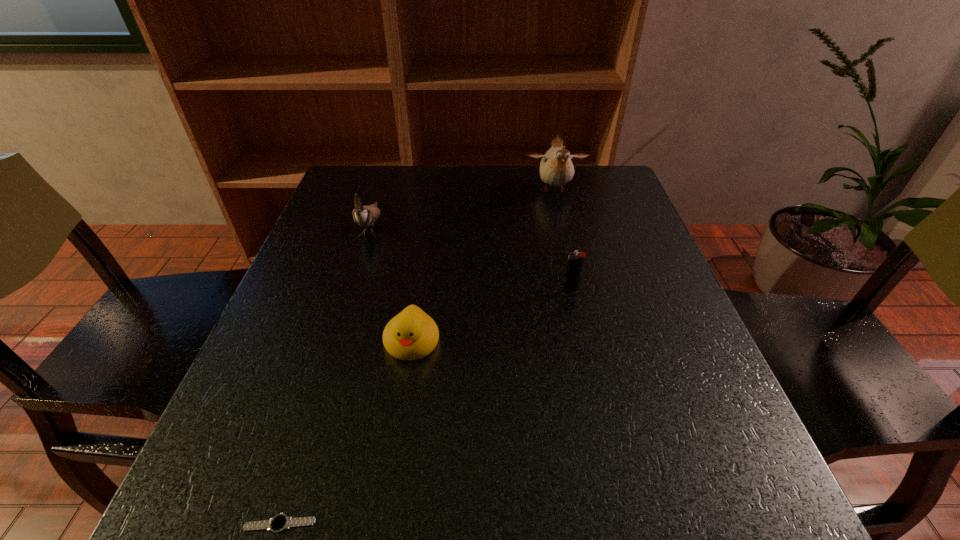
Find the location of a particular element. The width and height of the screenshot is (960, 540). the taller bird is located at coordinates click(x=556, y=167).

The image size is (960, 540). I want to click on the tallest object, so click(556, 167).

Where is `the second tallest object`? Image resolution: width=960 pixels, height=540 pixels. the second tallest object is located at coordinates (365, 216).

At what (x,y) coordinates should I click in order to perform the action: click on the nearer bird. Please return your answer as a coordinate pair (x, y). This screenshot has width=960, height=540. Looking at the image, I should click on point(365,216).

I want to click on the third shortest object, so click(x=575, y=262).

Where is `igniter`? The height and width of the screenshot is (540, 960). igniter is located at coordinates (575, 262).

Find the location of a particular element. This screenshot has height=540, width=960. the second shortest object is located at coordinates (412, 334).

Locate an element on the screen. The image size is (960, 540). the fourth farthest object is located at coordinates (412, 334).

At what (x,y) coordinates should I click in order to perform the action: click on the shortest object. Please return your answer as a coordinate pair (x, y). The image size is (960, 540). Looking at the image, I should click on (279, 523).

Where is `the nearest object`? Image resolution: width=960 pixels, height=540 pixels. the nearest object is located at coordinates (279, 523).